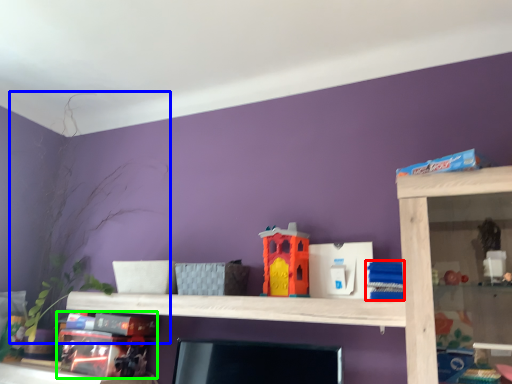
Question: Which object is the closest to the toy (highlighted by a red box)? Choose among these: plant (highlighted by a blue box) or toy (highlighted by a green box).

Choices:
 (A) plant
 (B) toy

Answer: (B)